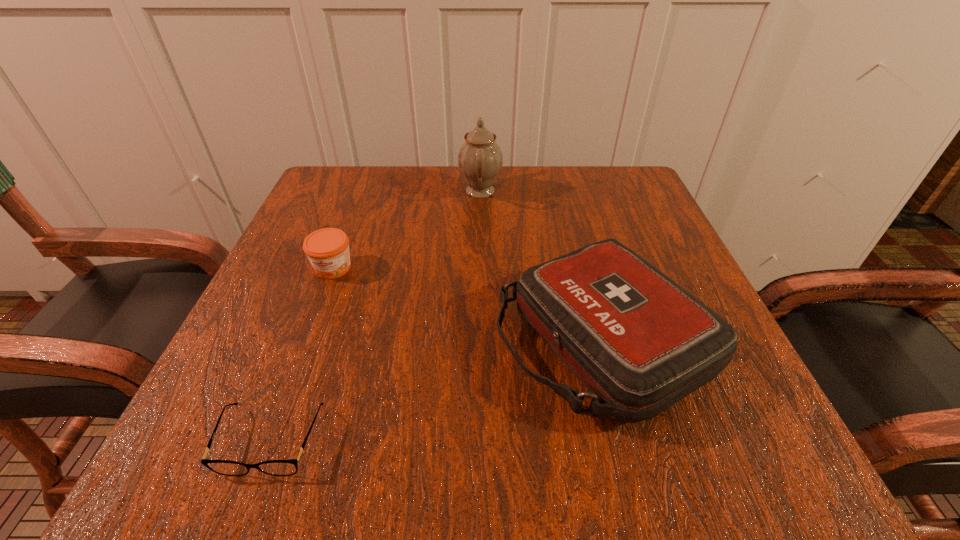
This screenshot has height=540, width=960. In the image, there is a desktop. In order to click on vacant space at the left edge in this screenshot , I will do `click(284, 402)`.

You are a GUI agent. You are given a task and a screenshot of the screen. Output one action in this format:
    pyautogui.click(x=<x>, y=<y>)
    Task: Click on the free region at the right edge
    This screenshot has height=540, width=960.
    Given the screenshot: What is the action you would take?
    pyautogui.click(x=623, y=226)

This screenshot has width=960, height=540. In the image, there is a desktop. What are the coordinates of `vacant space at the far left corner` in the screenshot? It's located at (320, 187).

In the image, there is a desktop. Where is `vacant space at the far right corner`? vacant space at the far right corner is located at coordinates (633, 201).

Where is `vacant space at the near right corner of the desktop`? vacant space at the near right corner of the desktop is located at coordinates (763, 466).

Locate an element on the screen. free space between the farthest object and the shortest object is located at coordinates (376, 315).

Find the location of a particular element. This screenshot has width=960, height=540. free spot between the tallest object and the jam is located at coordinates (407, 230).

This screenshot has height=540, width=960. In order to click on empty location between the tallest object and the spectacles in this screenshot , I will do tap(376, 315).

Find the location of a particular element. The width and height of the screenshot is (960, 540). unoccupied position between the chinaware and the jam is located at coordinates (407, 230).

Image resolution: width=960 pixels, height=540 pixels. In order to click on vacant point located between the second tallest object and the jam in this screenshot , I will do `click(467, 304)`.